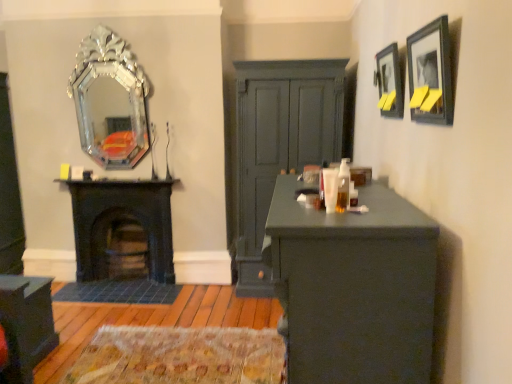
Question: From the image's perspective, would you say matte black picture frame at upper right, which appears as the 2th picture frame when viewed from the front, is positioned over black cast iron fireplace at left?

Choices:
 (A) yes
 (B) no

Answer: (A)

Question: Is matte black picture frame at upper right, placed as the first picture frame when sorted from back to front, facing towards black cast iron fireplace at left?

Choices:
 (A) no
 (B) yes

Answer: (A)

Question: Is black cast iron fireplace at left completely or partially inside matte black picture frame at upper right, which appears as the 2th picture frame when viewed from the front?

Choices:
 (A) no
 (B) yes

Answer: (A)

Question: Does matte black picture frame at upper right, which appears as the 2th picture frame when viewed from the front, touch black cast iron fireplace at left?

Choices:
 (A) yes
 (B) no

Answer: (B)

Question: Can you confirm if matte black picture frame at upper right, placed as the first picture frame when sorted from back to front, is thinner than black cast iron fireplace at left?

Choices:
 (A) yes
 (B) no

Answer: (A)

Question: Considering the positions of silver metallic mirror at upper left and matte black picture frame at upper right, which appears as the 2th picture frame when viewed from the front, in the image, is silver metallic mirror at upper left bigger or smaller than matte black picture frame at upper right, which appears as the 2th picture frame when viewed from the front,?

Choices:
 (A) big
 (B) small

Answer: (A)

Question: Which is correct: silver metallic mirror at upper left is inside matte black picture frame at upper right, placed as the first picture frame when sorted from back to front, or outside of it?

Choices:
 (A) inside
 (B) outside

Answer: (B)

Question: In terms of width, does silver metallic mirror at upper left look wider or thinner when compared to matte black picture frame at upper right, which appears as the 2th picture frame when viewed from the front?

Choices:
 (A) wide
 (B) thin

Answer: (A)

Question: Based on their positions, is silver metallic mirror at upper left located to the left or right of matte black picture frame at upper right, which appears as the 2th picture frame when viewed from the front?

Choices:
 (A) left
 (B) right

Answer: (A)

Question: Considering the positions of point (396, 94) and point (382, 241), is point (396, 94) closer or farther from the camera than point (382, 241)?

Choices:
 (A) closer
 (B) farther

Answer: (B)

Question: Looking at their shapes, would you say matte black picture frame at upper right, which appears as the 2th picture frame when viewed from the front, is wider or thinner than matte dark green desk at center?

Choices:
 (A) thin
 (B) wide

Answer: (A)

Question: From the image's perspective, relative to matte dark green desk at center, is matte black picture frame at upper right, which appears as the 2th picture frame when viewed from the front, above or below?

Choices:
 (A) above
 (B) below

Answer: (A)

Question: From a real-world perspective, is matte black picture frame at upper right, placed as the first picture frame when sorted from back to front, above or below matte dark green desk at center?

Choices:
 (A) above
 (B) below

Answer: (A)

Question: Is matte black cabinet at lower left wider or thinner than matte black picture frame at upper right, which appears as the 2th picture frame when viewed from the back?

Choices:
 (A) wide
 (B) thin

Answer: (A)

Question: Looking at the image, does matte black cabinet at lower left seem bigger or smaller compared to matte black picture frame at upper right, which appears as the 2th picture frame when viewed from the back?

Choices:
 (A) small
 (B) big

Answer: (B)